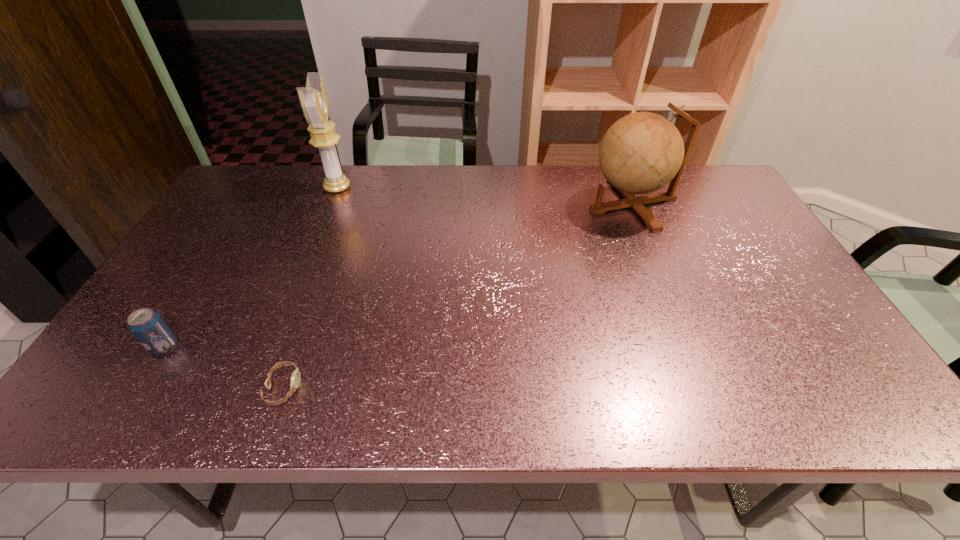
Find the location of a particular element. vacant point located on the back of the pop soda is located at coordinates (189, 306).

Find the location of a particular element. This screenshot has width=960, height=540. vacant space located 0.380m on the face of the shortest object is located at coordinates (481, 388).

Find the location of `award situated at the far edge`. award situated at the far edge is located at coordinates (313, 98).

Where is `globe at the far edge`? globe at the far edge is located at coordinates (641, 153).

Identify the location of object that is at the near edge. This screenshot has width=960, height=540. (296, 375).

At what (x,y) coordinates should I click in order to perform the action: click on object that is at the left edge. Please return your answer as a coordinate pair (x, y). This screenshot has width=960, height=540. Looking at the image, I should click on (150, 329).

Where is `vacant space at the far edge of the desktop`? This screenshot has width=960, height=540. vacant space at the far edge of the desktop is located at coordinates (364, 177).

This screenshot has height=540, width=960. In order to click on blank area at the near edge in this screenshot , I will do `click(499, 410)`.

The image size is (960, 540). Find the location of `free space at the left edge of the desktop`. free space at the left edge of the desktop is located at coordinates (204, 289).

This screenshot has width=960, height=540. Identify the location of vacant area at the far right corner of the desktop. 719,195.